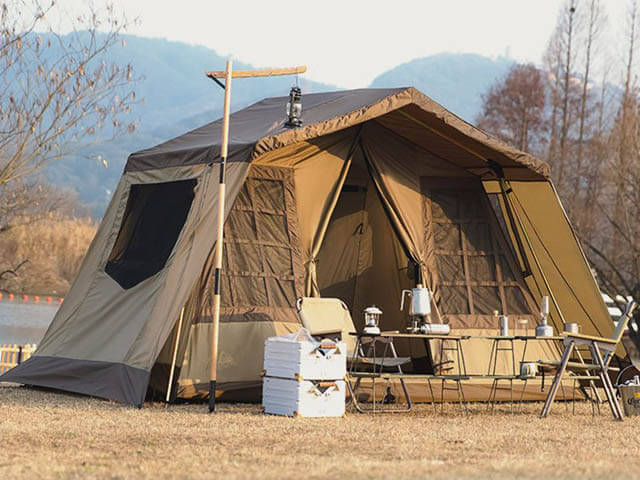
In order to click on chairs in this screenshot , I will do `click(589, 363)`, `click(330, 316)`.